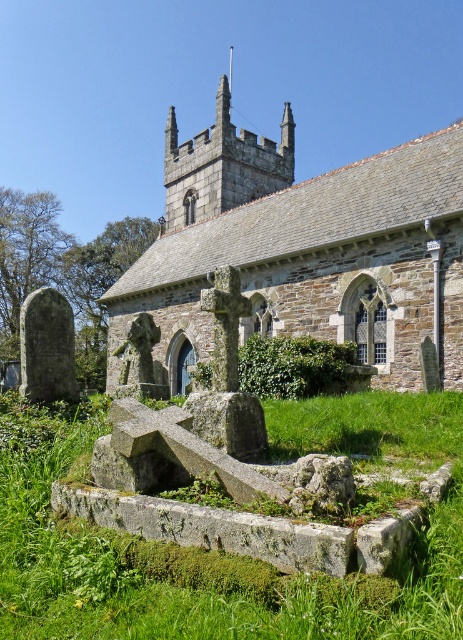
You are a visitor standing in the churchyard. You notice the stone church at center and the green mossy stone at center. Which object would appear closer to you if you were to walk towards the center of the churchyard?

The stone church at center is larger in size than the green mossy stone at center, so if you walk towards the center of the churchyard, the stone church at center would appear closer due to its larger size.

You are an architect visiting the churchyard and want to compare the sizes of the stone church at center and the green mossy stone at center. Which one is wider?

The stone church at center is wider than the green mossy stone at center because the stone church at center has a greater width than the green mossy stone at center according to the description.

Based on the scene description, which object is positioned to the right side when looking at the stone church at center and the green mossy stone at center?

The green mossy stone at center is positioned to the right of the stone church at center.